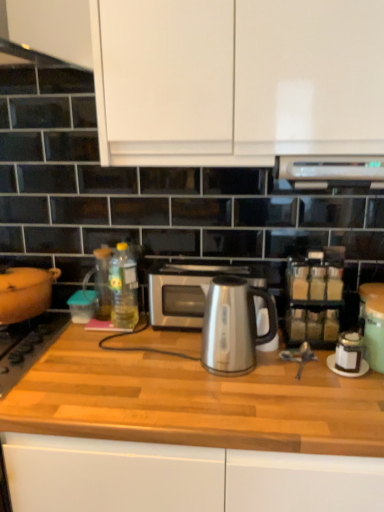
Question: Is translucent yellow bottle at center, which appears as the second bottle when viewed from the left, directly adjacent to satin silver kettle at center?

Choices:
 (A) yes
 (B) no

Answer: (B)

Question: From a real-world perspective, does translucent yellow bottle at center, marked as the first bottle in a right-to-left arrangement, sit lower than satin silver kettle at center?

Choices:
 (A) no
 (B) yes

Answer: (A)

Question: Is translucent yellow bottle at center, which appears as the second bottle when viewed from the left, turned away from satin silver kettle at center?

Choices:
 (A) no
 (B) yes

Answer: (A)

Question: Could you tell me if translucent yellow bottle at center, marked as the first bottle in a right-to-left arrangement, is facing satin silver kettle at center?

Choices:
 (A) no
 (B) yes

Answer: (A)

Question: Does translucent yellow bottle at center, marked as the first bottle in a right-to-left arrangement, contain satin silver kettle at center?

Choices:
 (A) no
 (B) yes

Answer: (A)

Question: Is translucent yellow bottle at center, marked as the first bottle in a right-to-left arrangement, further to camera compared to satin silver kettle at center?

Choices:
 (A) no
 (B) yes

Answer: (B)

Question: Is black glass gas stove at left not within translucent glass spice rack at right?

Choices:
 (A) yes
 (B) no

Answer: (A)

Question: Does black glass gas stove at left lie in front of translucent glass spice rack at right?

Choices:
 (A) yes
 (B) no

Answer: (A)

Question: From the image's perspective, is black glass gas stove at left located above translucent glass spice rack at right?

Choices:
 (A) no
 (B) yes

Answer: (A)

Question: Is translucent glass spice rack at right inside black glass gas stove at left?

Choices:
 (A) yes
 (B) no

Answer: (B)

Question: From a real-world perspective, is black glass gas stove at left below translucent glass spice rack at right?

Choices:
 (A) no
 (B) yes

Answer: (B)

Question: Does black glass gas stove at left have a lesser height compared to translucent glass spice rack at right?

Choices:
 (A) no
 (B) yes

Answer: (B)

Question: Can you confirm if white matte cabinet at upper center is smaller than satin silver microwave at center?

Choices:
 (A) yes
 (B) no

Answer: (B)